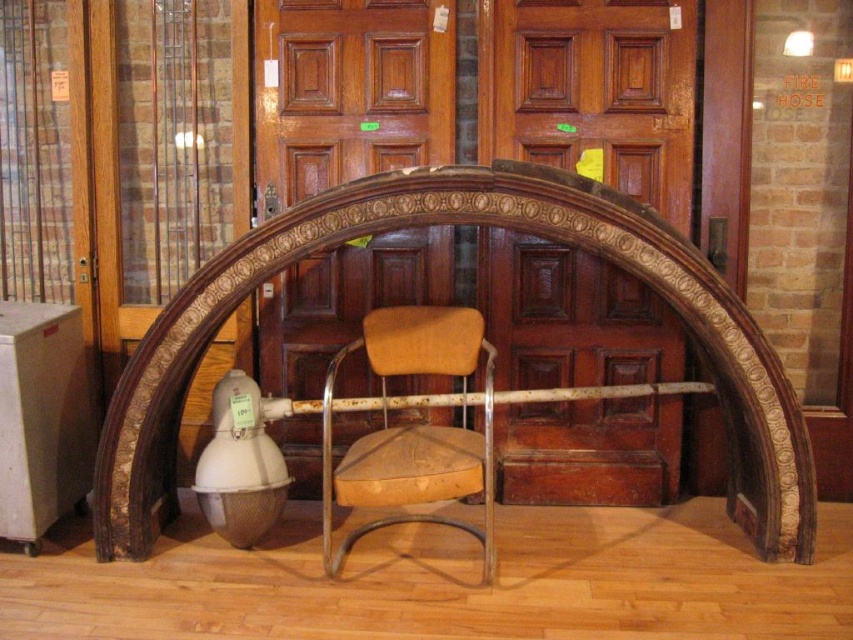
Which of these two, brown carved wood archway at center or brown leather chair at center, stands shorter?

brown leather chair at center is shorter.

Does brown carved wood archway at center have a lesser height compared to brown leather chair at center?

In fact, brown carved wood archway at center may be taller than brown leather chair at center.

Does point (625, 244) come closer to viewer compared to point (422, 449)?

That is True.

At what (x,y) coordinates should I click in order to perform the action: click on brown carved wood archway at center. Please return your answer as a coordinate pair (x, y). The height and width of the screenshot is (640, 853). Looking at the image, I should click on (459, 221).